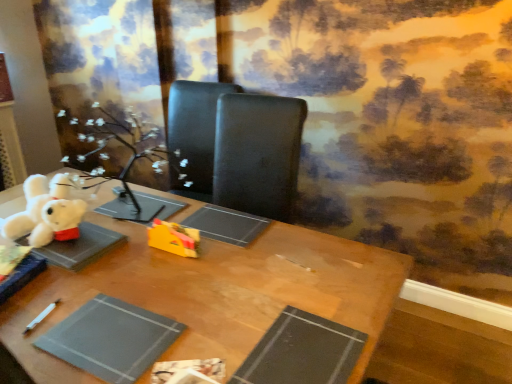
Question: Would you consider white plush bear at upper left, which appears as the 2th toy when viewed from the right, to be distant from black matte paperback book at lower center, which is counted as the 1th paperback book, starting from the right?

Choices:
 (A) no
 (B) yes

Answer: (A)

Question: Can you confirm if white plush bear at upper left, which appears as the 2th toy when viewed from the right, is thinner than black matte paperback book at lower center, marked as the second paperback book in a left-to-right arrangement?

Choices:
 (A) no
 (B) yes

Answer: (B)

Question: Can you confirm if white plush bear at upper left, which appears as the 2th toy when viewed from the right, is bigger than black matte paperback book at lower center, marked as the second paperback book in a left-to-right arrangement?

Choices:
 (A) no
 (B) yes

Answer: (B)

Question: From a real-world perspective, is white plush bear at upper left, arranged as the 1th toy when viewed from the left, positioned under black matte paperback book at lower center, which is counted as the 1th paperback book, starting from the right, based on gravity?

Choices:
 (A) no
 (B) yes

Answer: (A)

Question: Is white plush bear at upper left, arranged as the 1th toy when viewed from the left, wider than black matte paperback book at lower center, which is counted as the 1th paperback book, starting from the right?

Choices:
 (A) no
 (B) yes

Answer: (A)

Question: Would you say black matte paperback book at lower center, marked as the second paperback book in a left-to-right arrangement, is to the left or to the right of white plush bear at upper left, arranged as the 1th toy when viewed from the left, in the picture?

Choices:
 (A) left
 (B) right

Answer: (B)

Question: Looking at the image, does black matte paperback book at lower center, which is counted as the 1th paperback book, starting from the right, seem bigger or smaller compared to white plush bear at upper left, arranged as the 1th toy when viewed from the left?

Choices:
 (A) big
 (B) small

Answer: (B)

Question: Looking at their shapes, would you say black matte paperback book at lower center, which is counted as the 1th paperback book, starting from the right, is wider or thinner than white plush bear at upper left, which appears as the 2th toy when viewed from the right?

Choices:
 (A) wide
 (B) thin

Answer: (A)

Question: Is black matte paperback book at lower center, marked as the second paperback book in a left-to-right arrangement, inside the boundaries of white plush bear at upper left, arranged as the 1th toy when viewed from the left, or outside?

Choices:
 (A) outside
 (B) inside

Answer: (A)

Question: From a real-world perspective, is gray matte paper at lower left, which ranks as the 2th paperback book in right-to-left order, above or below white plush bear at upper left, which appears as the 2th toy when viewed from the right?

Choices:
 (A) below
 (B) above

Answer: (A)

Question: Considering the positions of point (117, 380) and point (48, 223), is point (117, 380) closer or farther from the camera than point (48, 223)?

Choices:
 (A) farther
 (B) closer

Answer: (B)

Question: Is gray matte paper at lower left, which appears as the first paperback book when viewed from the left, bigger or smaller than white plush bear at upper left, which appears as the 2th toy when viewed from the right?

Choices:
 (A) small
 (B) big

Answer: (A)

Question: Is gray matte paper at lower left, which appears as the first paperback book when viewed from the left, to the left or to the right of white plush bear at upper left, arranged as the 1th toy when viewed from the left, in the image?

Choices:
 (A) left
 (B) right

Answer: (B)

Question: Is wooden table at center spatially inside gray matte paper at lower left, which appears as the first paperback book when viewed from the left, or outside of it?

Choices:
 (A) inside
 (B) outside

Answer: (B)

Question: Considering the positions of wooden table at center and gray matte paper at lower left, which appears as the first paperback book when viewed from the left, in the image, is wooden table at center wider or thinner than gray matte paper at lower left, which appears as the first paperback book when viewed from the left,?

Choices:
 (A) thin
 (B) wide

Answer: (B)